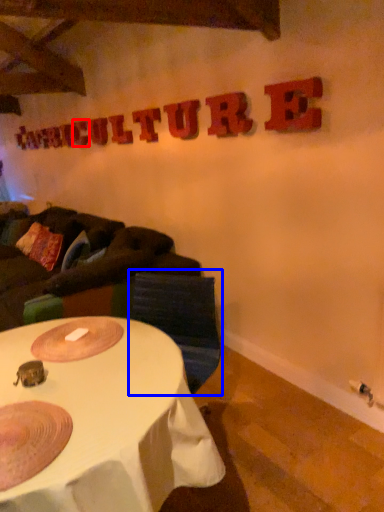
Question: Which of the following is the farthest to the observer, letter (highlighted by a red box) or swivel chair (highlighted by a blue box)?

Choices:
 (A) letter
 (B) swivel chair

Answer: (A)